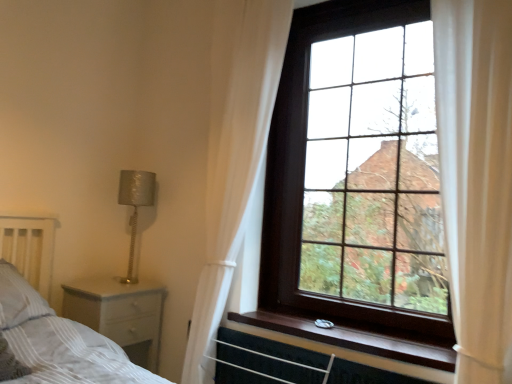
Question: Visually, is silver textured lamp at left positioned to the left or to the right of white wood nightstand at lower left?

Choices:
 (A) right
 (B) left

Answer: (A)

Question: From the image's perspective, is silver textured lamp at left above or below white wood nightstand at lower left?

Choices:
 (A) above
 (B) below

Answer: (A)

Question: Estimate the real-world distances between objects in this image. Which object is farther from the white striped pillow at lower left?

Choices:
 (A) wooden at upper right
 (B) dark wood window at upper right
 (C) white wood nightstand at lower left
 (D) white sheer curtain at upper right, arranged as the 2th curtain when viewed from the front
 (E) white sheer curtain at right, placed as the 1th curtain when sorted from right to left

Answer: (E)

Question: Which object is positioned closest to the silver textured lamp at left?

Choices:
 (A) white sheer curtain at right, the second curtain from the back
 (B) dark wood window at upper right
 (C) white wood nightstand at lower left
 (D) wooden at upper right
 (E) white striped pillow at lower left

Answer: (C)